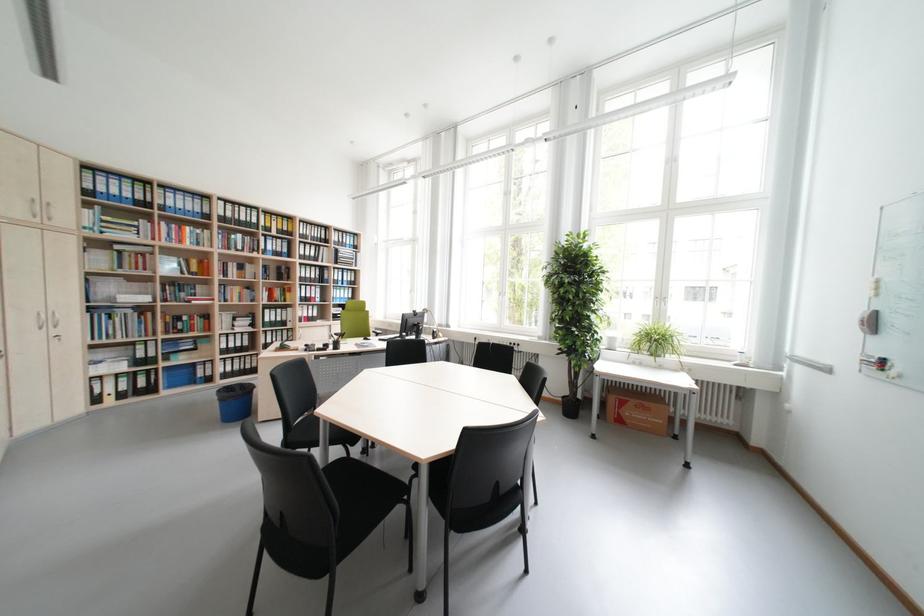
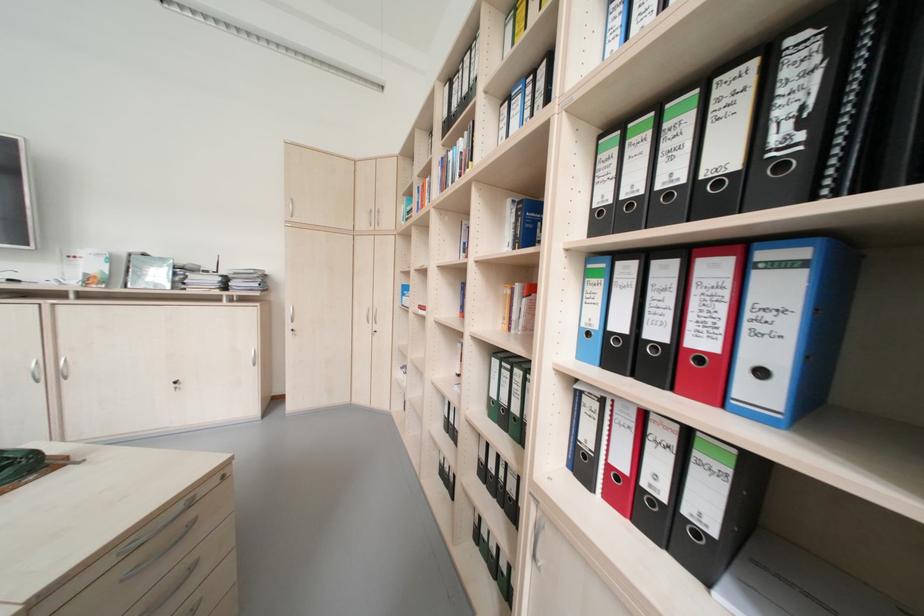
In the second image, find the point that corresponds to pixel 329 291 in the first image.

(793, 290)